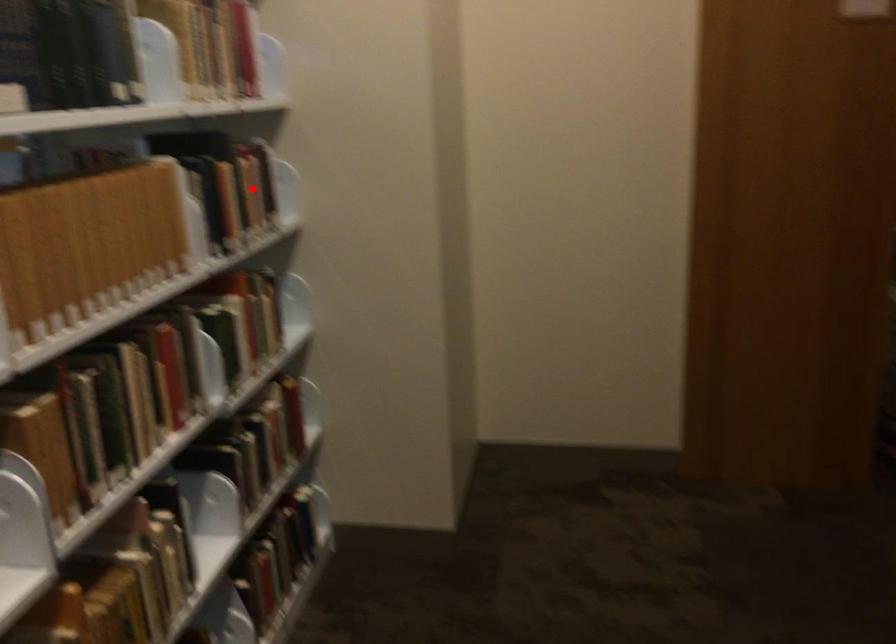
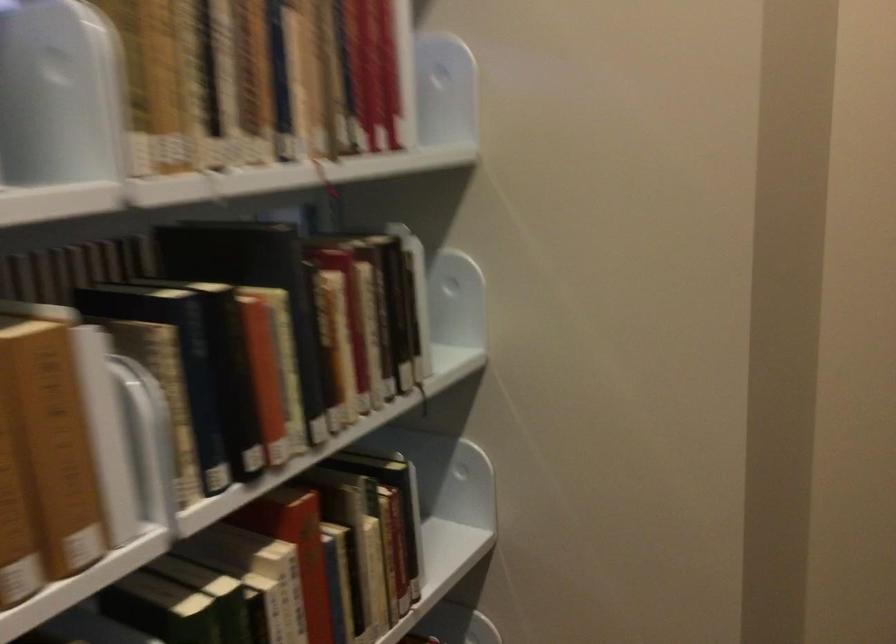
In the second image, find the point that corresponds to the highlighted location in the first image.

(366, 322)